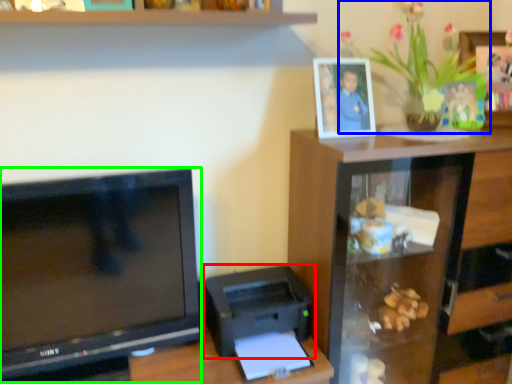
Question: Estimate the real-world distances between objects in this image. Which object is farther from printer (highlighted by a red box), houseplant (highlighted by a blue box) or television (highlighted by a green box)?

Choices:
 (A) houseplant
 (B) television

Answer: (A)